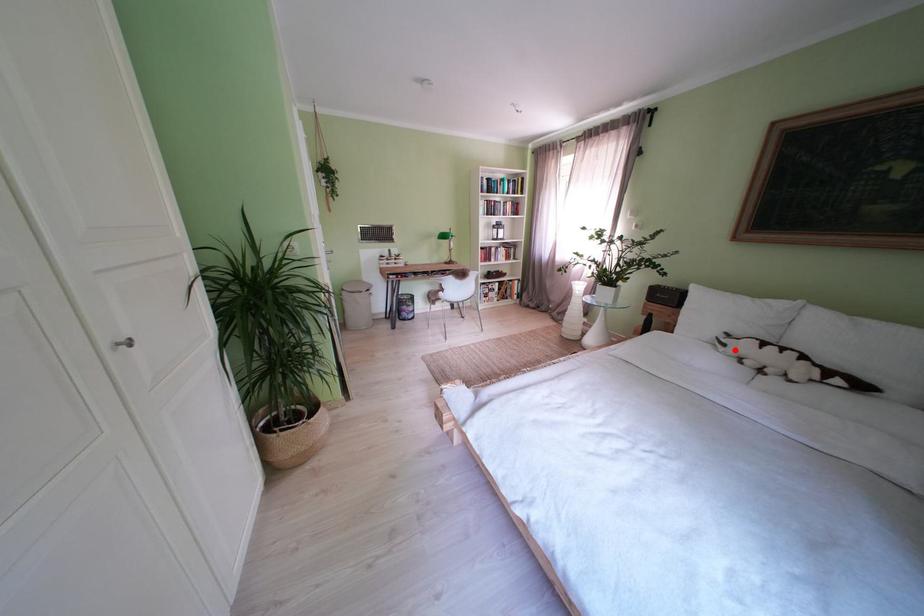
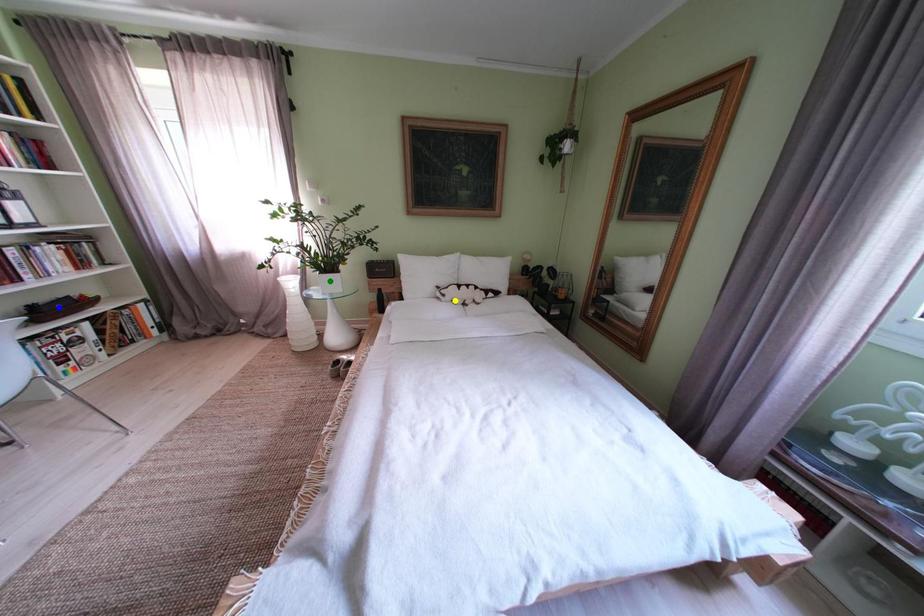
Question: I am providing you with two images of the same scene from different viewpoints. A red point is marked on the first image. You are given multiple points on the second image. Which mark in image 2 goes with the point in image 1?

Choices:
 (A) blue point
 (B) yellow point
 (C) green point

Answer: (B)